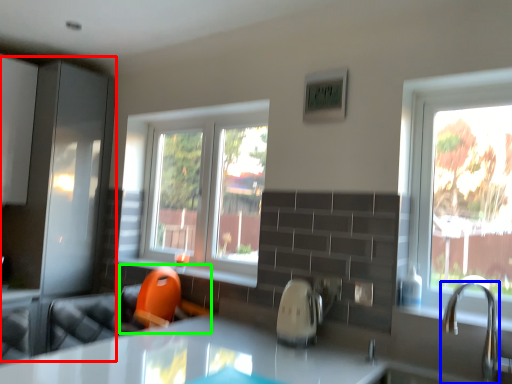
Question: Considering the real-world distances, which object is farthest from screen door (highlighted by a red box)? tap (highlighted by a blue box) or swivel chair (highlighted by a green box)?

Choices:
 (A) tap
 (B) swivel chair

Answer: (A)